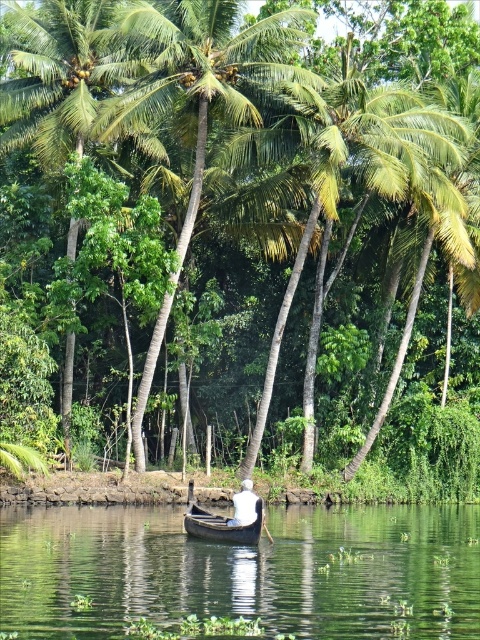
Question: Which object is closer to the camera taking this photo?

Choices:
 (A) white fabric at center
 (B) green smooth water at center

Answer: (B)

Question: Which point appears closest to the camera in this image?

Choices:
 (A) (113, 547)
 (B) (247, 502)
 (C) (237, 508)
 (D) (257, 29)

Answer: (C)

Question: Considering the relative positions of green smooth water at center and green leafy palm tree at upper center in the image provided, where is green smooth water at center located with respect to green leafy palm tree at upper center?

Choices:
 (A) below
 (B) above

Answer: (A)

Question: Can you confirm if green smooth water at center is thinner than white fabric at center?

Choices:
 (A) yes
 (B) no

Answer: (B)

Question: Can you confirm if green smooth water at center is positioned to the right of black wood boat at center?

Choices:
 (A) yes
 (B) no

Answer: (B)

Question: Which object appears farthest from the camera in this image?

Choices:
 (A) green leafy palm tree at upper center
 (B) black wood boat at center

Answer: (A)